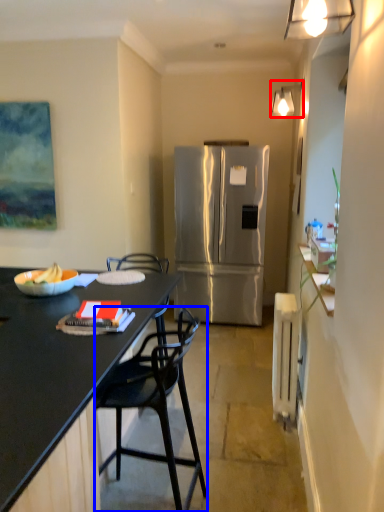
Question: Which object is further to the camera taking this photo, lamp (highlighted by a red box) or chair (highlighted by a blue box)?

Choices:
 (A) lamp
 (B) chair

Answer: (A)